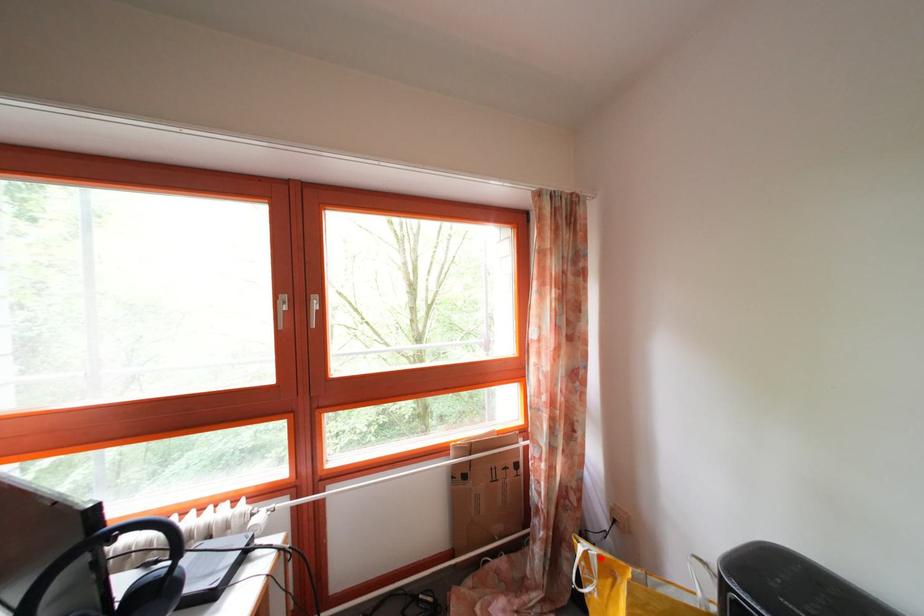
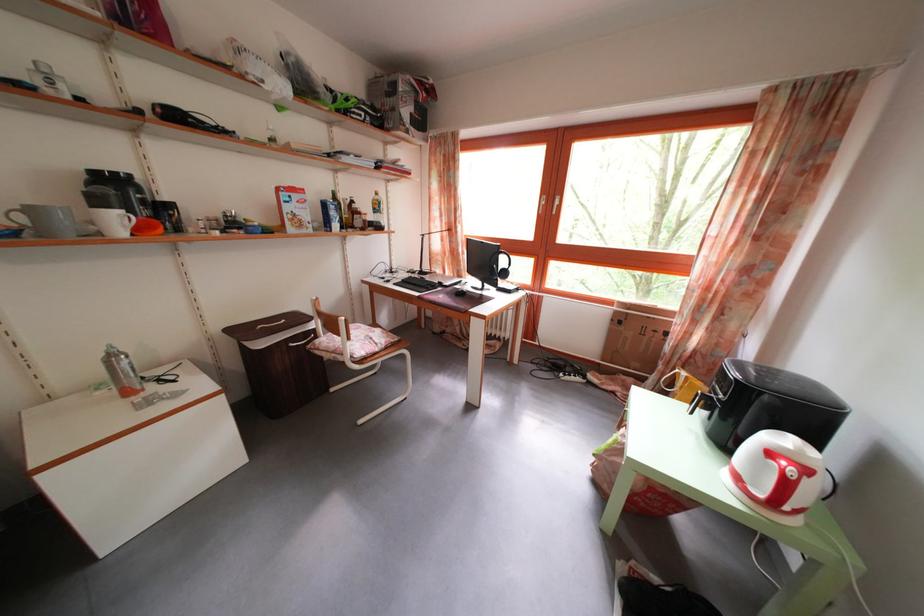
Find the pixel in the second image that matches the highlighted location in the first image.

(691, 381)